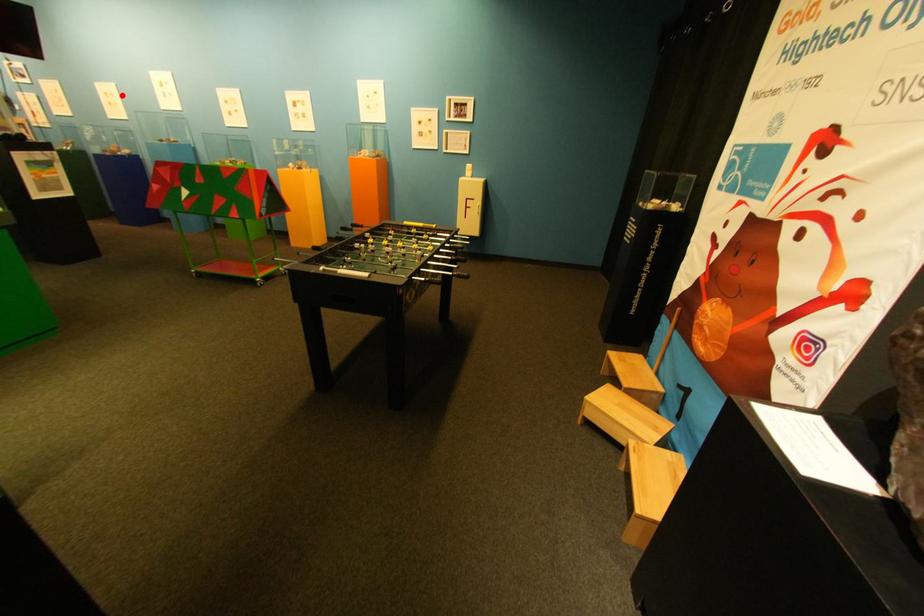
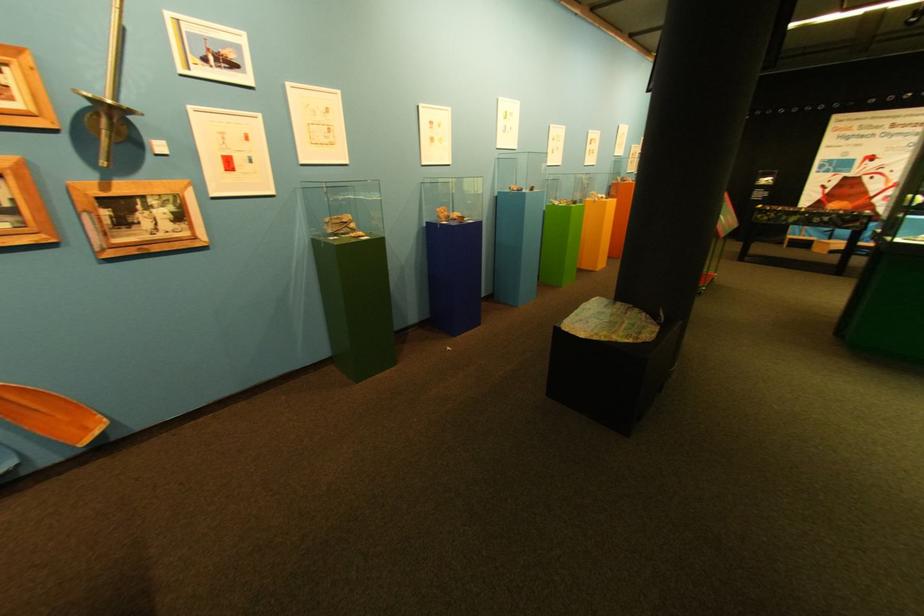
Question: A red point is marked in image1. In image2, is the corresponding 3D point closer to the camera or farther? Reply with the corresponding letter.

Choices:
 (A) The corresponding 3D point is closer.
 (B) The corresponding 3D point is farther.

Answer: (A)